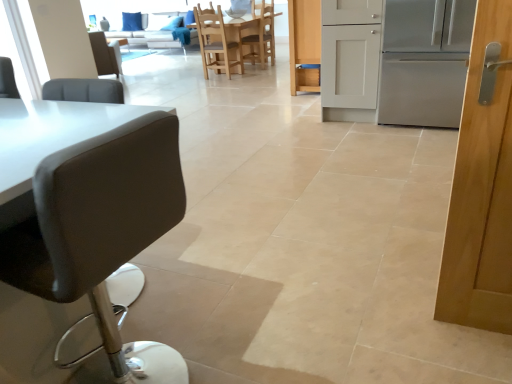
Question: Is point (415, 38) closer or farther from the camera than point (309, 54)?

Choices:
 (A) farther
 (B) closer

Answer: (B)

Question: Would you say stainless steel refrigerator at right is to the left or to the right of white wood cabinet at center in the picture?

Choices:
 (A) right
 (B) left

Answer: (A)

Question: Considering the real-world distances, which object is closest to the stainless steel refrigerator at right?

Choices:
 (A) matte black stool at left, positioned as the 3th chair in left-to-right order
 (B) wooden chair at center, which appears as the third chair when viewed from the right
 (C) white fabric couch at upper center
 (D) black leather chair at upper left, marked as the 1th chair in a left-to-right arrangement
 (E) light brown wooden chair at center, marked as the 4th chair in a front-to-back arrangement

Answer: (A)

Question: Which object is positioned farthest from the stainless steel refrigerator at right?

Choices:
 (A) light wood table at center
 (B) wooden chair at center, positioned as the second chair in front-to-back order
 (C) matte black stool at left, the 1th chair positioned from the bottom
 (D) white wood cabinet at center
 (E) white fabric couch at upper center

Answer: (E)